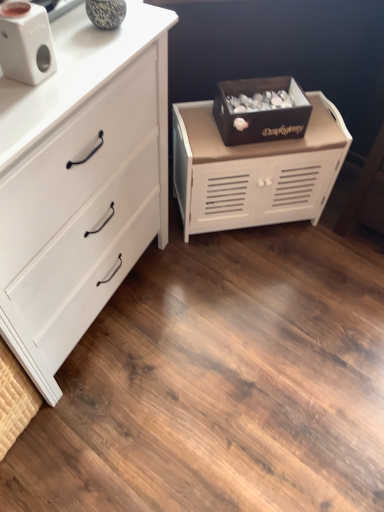
I want to click on white matte cabinet at center, which is the first chest of drawers from right to left, so click(254, 170).

Describe the element at coordinates (260, 110) in the screenshot. I see `dark brown wooden box at center` at that location.

Locate an element on the screen. This screenshot has width=384, height=512. white matte cabinet at center, the 2th chest of drawers from the left is located at coordinates (254, 170).

Could you tell me if white matte chest of drawers at left, the first chest of drawers from the left, is turned towards white matte speaker at upper left?

No, white matte chest of drawers at left, the first chest of drawers from the left, is not turned towards white matte speaker at upper left.

Which object is positioned more to the right, white matte chest of drawers at left, the first chest of drawers from the left, or white matte speaker at upper left?

From the viewer's perspective, white matte speaker at upper left appears more on the right side.

From the image's perspective, does white matte chest of drawers at left, arranged as the second chest of drawers when viewed from the right, appear higher than white matte speaker at upper left?

Actually, white matte chest of drawers at left, arranged as the second chest of drawers when viewed from the right, appears below white matte speaker at upper left in the image.

Locate an element on the screen. speaker that appears on the right of white matte chest of drawers at left, arranged as the second chest of drawers when viewed from the right is located at coordinates (26, 42).

Between dark brown wooden box at center and white matte cabinet at center, which is the first chest of drawers from right to left, which one appears on the left side from the viewer's perspective?

white matte cabinet at center, which is the first chest of drawers from right to left, is more to the left.

From the image's perspective, is dark brown wooden box at center located beneath white matte cabinet at center, the 2th chest of drawers from the left?

No.

From the dark brown wooden box at center, count the 1st chest of drawers to the left and point to it. Please provide its 2D coordinates.

[(254, 170)]

Between white matte chest of drawers at left, the first chest of drawers from the left, and white matte cabinet at center, the 2th chest of drawers from the left, which one has more height?

white matte chest of drawers at left, the first chest of drawers from the left.

Which point is more distant from viewer, [132,214] or [289,149]?

The point [289,149] is behind.

Considering the sizes of white matte chest of drawers at left, the first chest of drawers from the left, and white matte cabinet at center, which is the first chest of drawers from right to left, in the image, is white matte chest of drawers at left, the first chest of drawers from the left, bigger or smaller than white matte cabinet at center, which is the first chest of drawers from right to left,?

In the image, white matte chest of drawers at left, the first chest of drawers from the left, appears to be larger than white matte cabinet at center, which is the first chest of drawers from right to left.

Locate an element on the screen. speaker located above the white matte chest of drawers at left, arranged as the second chest of drawers when viewed from the right (from the image's perspective) is located at coordinates (26, 42).

How many degrees apart are the facing directions of white matte speaker at upper left and white matte chest of drawers at left, the first chest of drawers from the left?

There is a 0.378-degree angle between the facing directions of white matte speaker at upper left and white matte chest of drawers at left, the first chest of drawers from the left.

From a real-world perspective, is white matte speaker at upper left physically above white matte chest of drawers at left, arranged as the second chest of drawers when viewed from the right?

Yes.

Is white matte speaker at upper left positioned behind white matte chest of drawers at left, the first chest of drawers from the left?

Yes, the depth of white matte speaker at upper left is greater than that of white matte chest of drawers at left, the first chest of drawers from the left.

In terms of height, does dark brown wooden box at center look taller or shorter compared to white matte chest of drawers at left, the first chest of drawers from the left?

Considering their sizes, dark brown wooden box at center has less height than white matte chest of drawers at left, the first chest of drawers from the left.

In the scene shown: How many degrees apart are the facing directions of dark brown wooden box at center and white matte chest of drawers at left, the first chest of drawers from the left?

52.9 degrees.

From a real-world perspective, who is located higher, dark brown wooden box at center or white matte chest of drawers at left, arranged as the second chest of drawers when viewed from the right?

In real-world perspective, dark brown wooden box at center is above.

Is dark brown wooden box at center located outside white matte chest of drawers at left, the first chest of drawers from the left?

Yes, dark brown wooden box at center is not within white matte chest of drawers at left, the first chest of drawers from the left.

Is white matte speaker at upper left inside dark brown wooden box at center?

No, white matte speaker at upper left is not surrounded by dark brown wooden box at center.

Considering the positions of objects dark brown wooden box at center and white matte speaker at upper left in the image provided, who is more to the right, dark brown wooden box at center or white matte speaker at upper left?

Positioned to the right is dark brown wooden box at center.

Considering the positions of point (256, 105) and point (15, 11), is point (256, 105) closer or farther from the camera than point (15, 11)?

Clearly, point (256, 105) is more distant from the camera than point (15, 11).

Measure the distance between white matte cabinet at center, which is the first chest of drawers from right to left, and white matte chest of drawers at left, the first chest of drawers from the left.

42.84 centimeters.

Consider the image. From a real-world perspective, is white matte cabinet at center, the 2th chest of drawers from the left, physically located above or below white matte chest of drawers at left, arranged as the second chest of drawers when viewed from the right?

white matte cabinet at center, the 2th chest of drawers from the left, is below white matte chest of drawers at left, arranged as the second chest of drawers when viewed from the right.

Is white matte cabinet at center, which is the first chest of drawers from right to left, situated inside white matte chest of drawers at left, the first chest of drawers from the left, or outside?

white matte cabinet at center, which is the first chest of drawers from right to left, cannot be found inside white matte chest of drawers at left, the first chest of drawers from the left.

Is white matte cabinet at center, the 2th chest of drawers from the left, oriented away from white matte chest of drawers at left, the first chest of drawers from the left?

No.

Locate an element on the screen. the chest of drawers located in front of the white matte speaker at upper left is located at coordinates (80, 182).

You are a GUI agent. You are given a task and a screenshot of the screen. Output one action in this format:
    pyautogui.click(x=<x>, y=<y>)
    Task: Click on the storage box above the white matte cabinet at center, which is the first chest of drawers from right to left (from a real-world perspective)
    The image size is (384, 512).
    Given the screenshot: What is the action you would take?
    pyautogui.click(x=260, y=110)

Looking at the image, which one is located further to white matte speaker at upper left, white matte cabinet at center, which is the first chest of drawers from right to left, or dark brown wooden box at center?

white matte cabinet at center, which is the first chest of drawers from right to left, lies further to white matte speaker at upper left than the other object.

Based on their spatial positions, is white matte speaker at upper left or white matte cabinet at center, the 2th chest of drawers from the left, further from white matte chest of drawers at left, the first chest of drawers from the left?

The object further to white matte chest of drawers at left, the first chest of drawers from the left, is white matte cabinet at center, the 2th chest of drawers from the left.

Which object lies further to the anchor point white matte chest of drawers at left, arranged as the second chest of drawers when viewed from the right, white matte speaker at upper left or dark brown wooden box at center?

dark brown wooden box at center.

Based on their spatial positions, is white matte cabinet at center, the 2th chest of drawers from the left, or white matte speaker at upper left further from white matte chest of drawers at left, arranged as the second chest of drawers when viewed from the right?

white matte cabinet at center, the 2th chest of drawers from the left, is further to white matte chest of drawers at left, arranged as the second chest of drawers when viewed from the right.

Based on their spatial positions, is white matte chest of drawers at left, the first chest of drawers from the left, or dark brown wooden box at center further from white matte cabinet at center, which is the first chest of drawers from right to left?

white matte chest of drawers at left, the first chest of drawers from the left.

Based on their spatial positions, is dark brown wooden box at center or white matte speaker at upper left closer to white matte cabinet at center, the 2th chest of drawers from the left?

dark brown wooden box at center.

Estimate the real-world distances between objects in this image. Which object is closer to dark brown wooden box at center, white matte speaker at upper left or white matte chest of drawers at left, arranged as the second chest of drawers when viewed from the right?

Based on the image, white matte chest of drawers at left, arranged as the second chest of drawers when viewed from the right, appears to be nearer to dark brown wooden box at center.

Looking at this image, looking at the image, which one is located closer to white matte speaker at upper left, dark brown wooden box at center or white matte cabinet at center, the 2th chest of drawers from the left?

Among the two, dark brown wooden box at center is located nearer to white matte speaker at upper left.

Identify the location of storage box between white matte chest of drawers at left, the first chest of drawers from the left, and white matte cabinet at center, the 2th chest of drawers from the left, in the front-back direction. (260, 110).

You are a GUI agent. You are given a task and a screenshot of the screen. Output one action in this format:
    pyautogui.click(x=<x>, y=<y>)
    Task: Click on the speaker between white matte chest of drawers at left, the first chest of drawers from the left, and dark brown wooden box at center in the front-back direction
    
    Given the screenshot: What is the action you would take?
    pyautogui.click(x=26, y=42)

You are a GUI agent. You are given a task and a screenshot of the screen. Output one action in this format:
    pyautogui.click(x=<x>, y=<y>)
    Task: Click on the speaker positioned between white matte chest of drawers at left, arranged as the second chest of drawers when viewed from the right, and white matte cabinet at center, the 2th chest of drawers from the left, from near to far
    This screenshot has height=512, width=384.
    Given the screenshot: What is the action you would take?
    pyautogui.click(x=26, y=42)

Image resolution: width=384 pixels, height=512 pixels. I want to click on storage box between white matte speaker at upper left and white matte cabinet at center, the 2th chest of drawers from the left, along the z-axis, so click(260, 110).